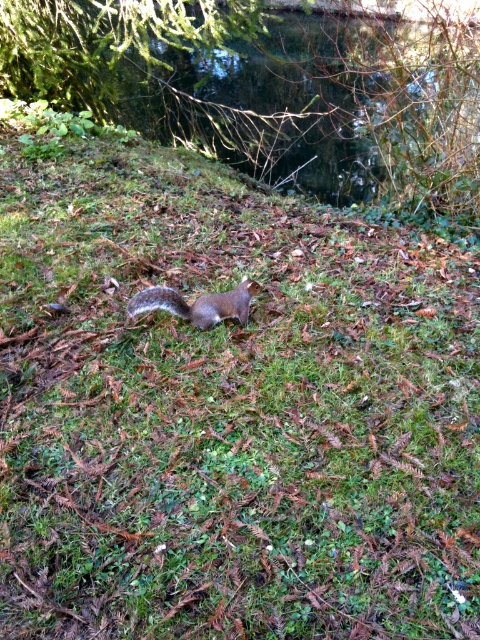
Can you confirm if gray-furred squirrel at center is taller than gray furry tail at center?

Indeed, gray-furred squirrel at center has a greater height compared to gray furry tail at center.

How much distance is there between gray-furred squirrel at center and gray furry tail at center?

gray-furred squirrel at center is 2.33 inches from gray furry tail at center.

Is point (130, 308) positioned before point (135, 308)?

No, (130, 308) is further to viewer.

This screenshot has height=640, width=480. Identify the location of gray-furred squirrel at center. (196, 304).

Does green mossy tree at upper left have a lesser width compared to gray furry tail at center?

Incorrect, green mossy tree at upper left's width is not less than gray furry tail at center's.

At what (x,y) coordinates should I click in order to perform the action: click on green mossy tree at upper left. Please return your answer as a coordinate pair (x, y). The image size is (480, 640). Looking at the image, I should click on point(273,86).

In the scene shown: Can you confirm if green mossy tree at upper left is smaller than gray-furred squirrel at center?

Incorrect, green mossy tree at upper left is not smaller in size than gray-furred squirrel at center.

Is green mossy tree at upper left bigger than gray-furred squirrel at center?

Yes, green mossy tree at upper left is bigger than gray-furred squirrel at center.

Identify the location of green mossy tree at upper left. The image size is (480, 640). (273, 86).

Where is `green mossy tree at upper left`? This screenshot has height=640, width=480. green mossy tree at upper left is located at coordinates (273, 86).